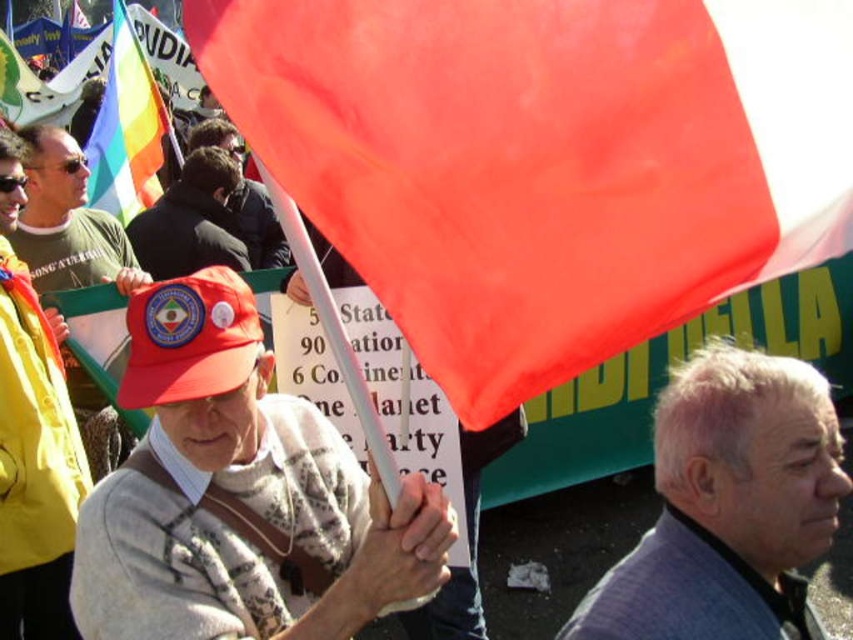
Is gray wool sweater at lower right taller than rainbow fabric flag at upper left?

No.

Does point (827, 516) lie in front of point (148, 189)?

Yes, point (827, 516) is in front of point (148, 189).

This screenshot has height=640, width=853. Describe the element at coordinates (728, 506) in the screenshot. I see `gray wool sweater at lower right` at that location.

Find the location of `gray wool sweater at lower right`. gray wool sweater at lower right is located at coordinates (728, 506).

Does matte orange flag at center come behind rainbow fabric flag at upper left?

No.

Identify the location of matte orange flag at center. (503, 168).

Who is more forward, (524,225) or (146,154)?

Positioned in front is point (524,225).

Image resolution: width=853 pixels, height=640 pixels. Identify the location of matte orange flag at center. (503, 168).

Is point (552, 6) behind point (315, 492)?

No, (552, 6) is in front of (315, 492).

Which is below, matte orange flag at center or matte red cap at center?

Positioned lower is matte red cap at center.

Does point (537, 237) come closer to viewer compared to point (138, 554)?

Yes, point (537, 237) is closer to viewer.

At what (x,y) coordinates should I click in order to perform the action: click on matte orange flag at center. Please return your answer as a coordinate pair (x, y). Looking at the image, I should click on (503, 168).